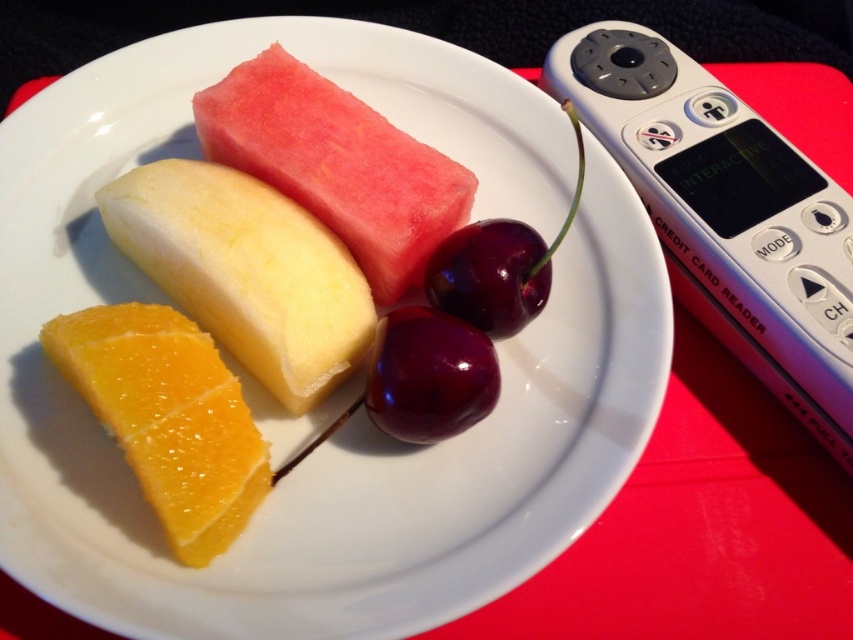
Who is higher up, yellow matte apple at center or shiny dark red plum at center?

yellow matte apple at center is above.

Locate an element on the screen. yellow matte apple at center is located at coordinates (247, 273).

Identify the location of yellow matte apple at center. (247, 273).

Does white plastic remote at right have a smaller size compared to yellow matte apple at center?

No.

Can you confirm if white plastic remote at right is positioned to the left of yellow matte apple at center?

Incorrect, white plastic remote at right is not on the left side of yellow matte apple at center.

Locate an element on the screen. white plastic remote at right is located at coordinates (727, 214).

From the picture: Is yellow matte apple at center smaller than red matte watermelon at center?

Incorrect, yellow matte apple at center is not smaller in size than red matte watermelon at center.

Is point (265, 195) positioned after point (410, 145)?

No, (265, 195) is in front of (410, 145).

Is point (169, 244) positioned before point (277, 54)?

Yes, point (169, 244) is in front of point (277, 54).

Find the location of a particular element. yellow matte apple at center is located at coordinates (247, 273).